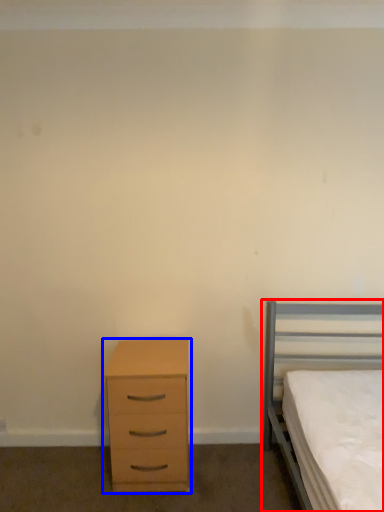
Question: Among these objects, which one is farthest to the camera, bed (highlighted by a red box) or chest of drawers (highlighted by a blue box)?

Choices:
 (A) bed
 (B) chest of drawers

Answer: (B)